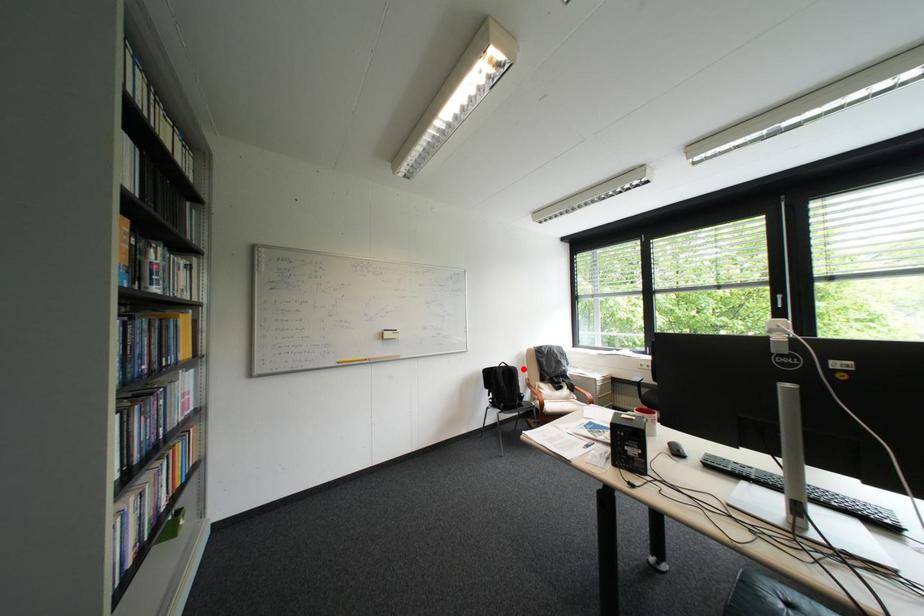
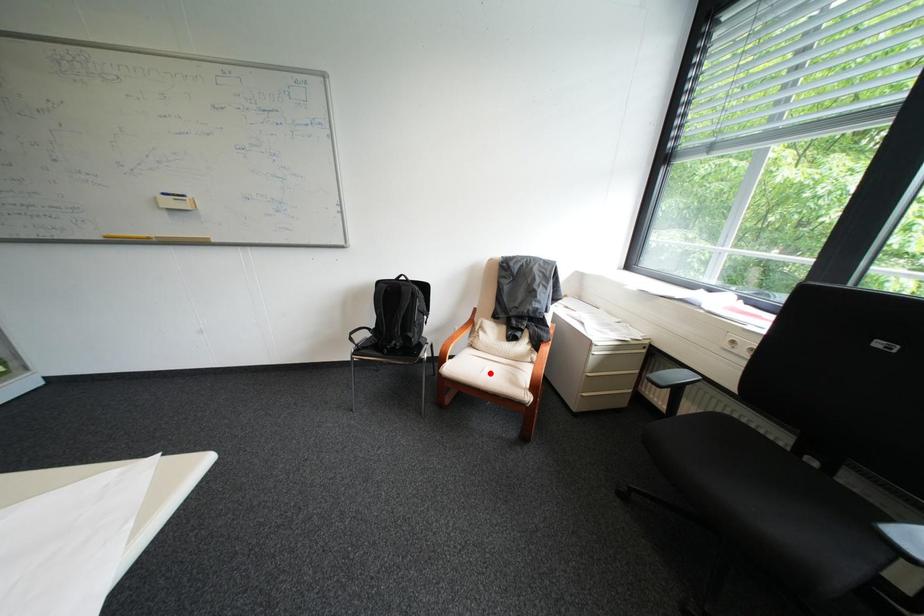
I am providing you with two images of the same scene from different viewpoints. A red point is marked on the first image and another point is marked on the second image. Is the marked point in image1 the same physical position as the marked point in image2?

No